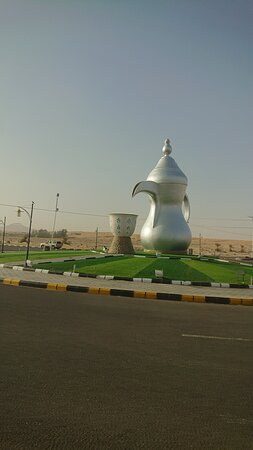
I want to click on pot, so click(172, 221).